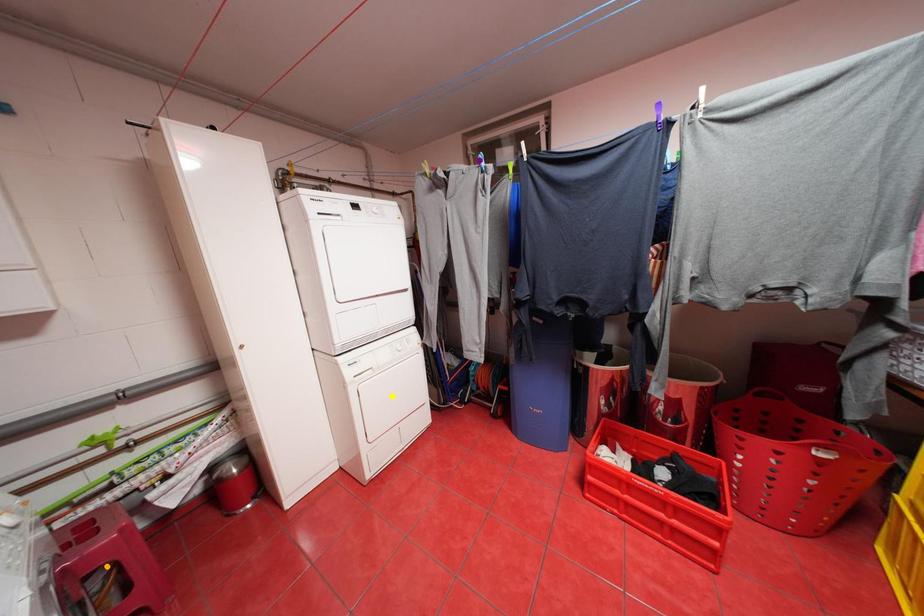
Order these from nearest to farthest:
purple point
orange point
yellow point

yellow point < purple point < orange point